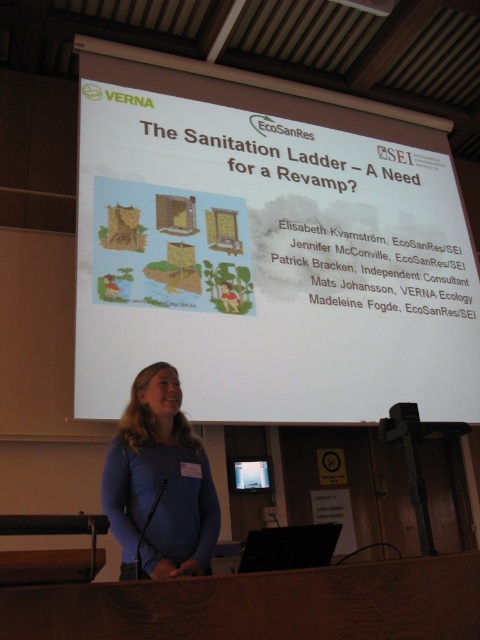
Question: Is white matte projector screen at upper center closer to the viewer compared to matte blue shirt at center?

Choices:
 (A) no
 (B) yes

Answer: (A)

Question: Which of the following is the farthest from the observer?

Choices:
 (A) (208, 547)
 (B) (348, 320)
 (C) (244, 465)

Answer: (C)

Question: Estimate the real-world distances between objects in this image. Which object is farther from the matte blue shirt at center?

Choices:
 (A) matte black screen at center
 (B) white matte projector screen at upper center

Answer: (A)

Question: Does matte blue shirt at center have a smaller size compared to matte black screen at center?

Choices:
 (A) yes
 (B) no

Answer: (B)

Question: Is white matte projector screen at upper center further to camera compared to matte blue shirt at center?

Choices:
 (A) yes
 (B) no

Answer: (A)

Question: Estimate the real-world distances between objects in this image. Which object is farther from the white matte projector screen at upper center?

Choices:
 (A) matte blue shirt at center
 (B) matte black screen at center

Answer: (A)